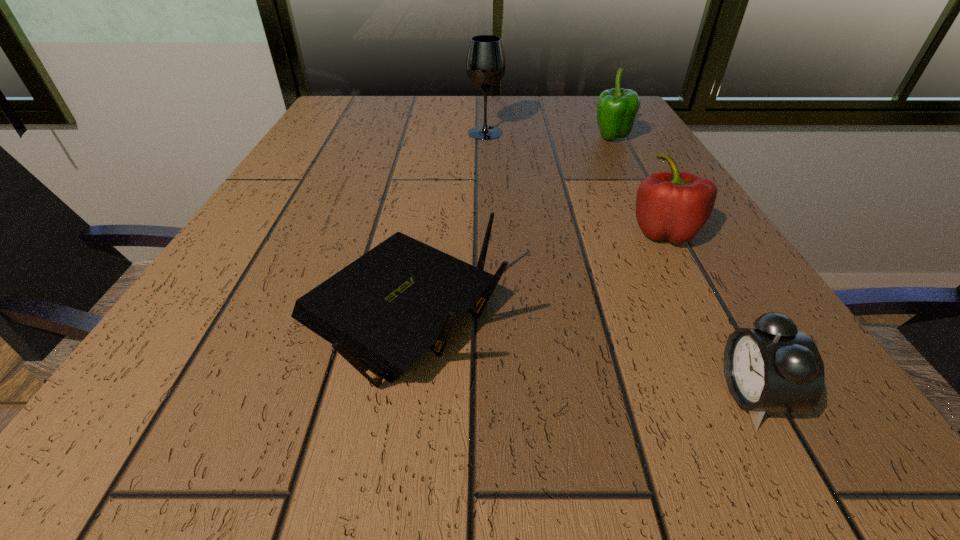
I want to click on free space located on the front side of the alarm clock, so click(x=525, y=394).

Identify the location of free space located 0.140m on the front side of the alarm clock. (598, 394).

Find the location of a particular element. free space located 0.240m on the front side of the alarm clock is located at coordinates (507, 394).

What are the coordinates of `wineglass that is positioned at the far edge` in the screenshot? It's located at (485, 64).

At what (x,y) coordinates should I click in order to perform the action: click on bell pepper that is positioned at the far edge. Please return your answer as a coordinate pair (x, y). Looking at the image, I should click on (617, 108).

Where is `router that is at the near edge`? This screenshot has width=960, height=540. router that is at the near edge is located at coordinates (382, 312).

This screenshot has width=960, height=540. Find the location of `alarm clock located in the near edge section of the desktop`. alarm clock located in the near edge section of the desktop is located at coordinates (774, 367).

Where is `object situated at the left edge`? object situated at the left edge is located at coordinates (382, 312).

Where is `alarm clock present at the right edge`? The image size is (960, 540). alarm clock present at the right edge is located at coordinates (774, 367).

Find the location of a particular element. This screenshot has width=960, height=540. object located in the near left corner section of the desktop is located at coordinates (382, 312).